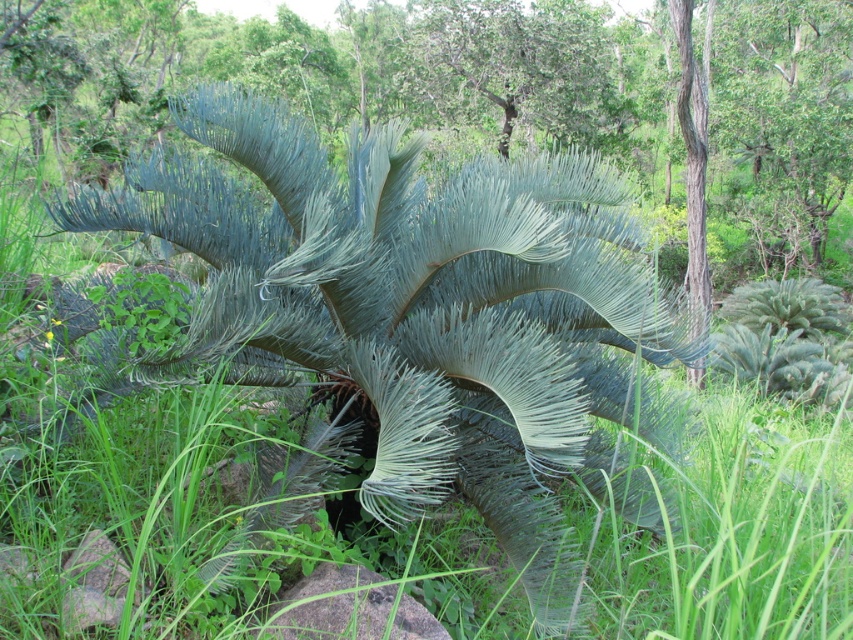
Find the location of a particular element. This screenshot has height=640, width=853. green fibrous fern at center is located at coordinates (416, 320).

In the scene shown: Which is more to the left, green fibrous fern at center or gray rock at center?

green fibrous fern at center

Where is `green fibrous fern at center`? This screenshot has width=853, height=640. green fibrous fern at center is located at coordinates (416, 320).

In order to click on green fibrous fern at center in this screenshot , I will do `click(416, 320)`.